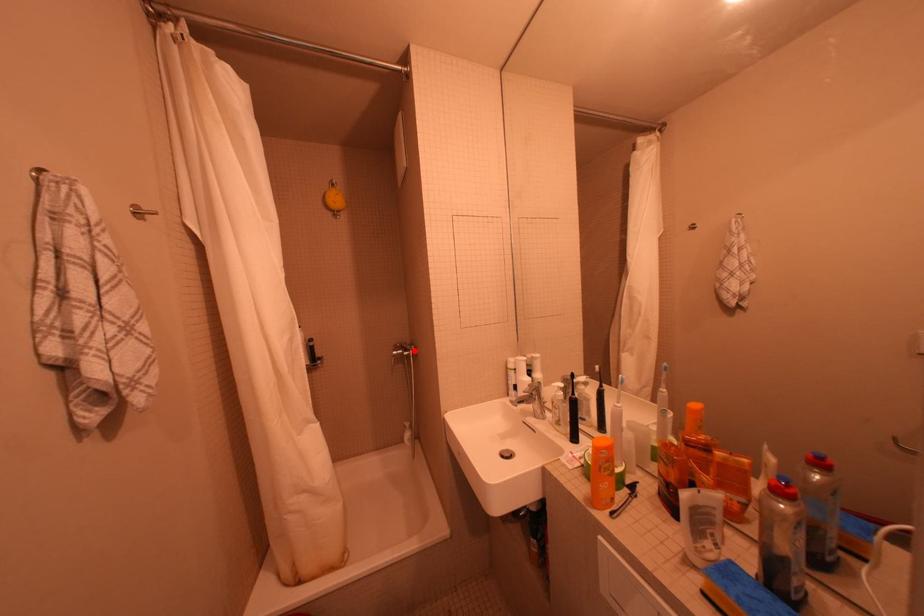
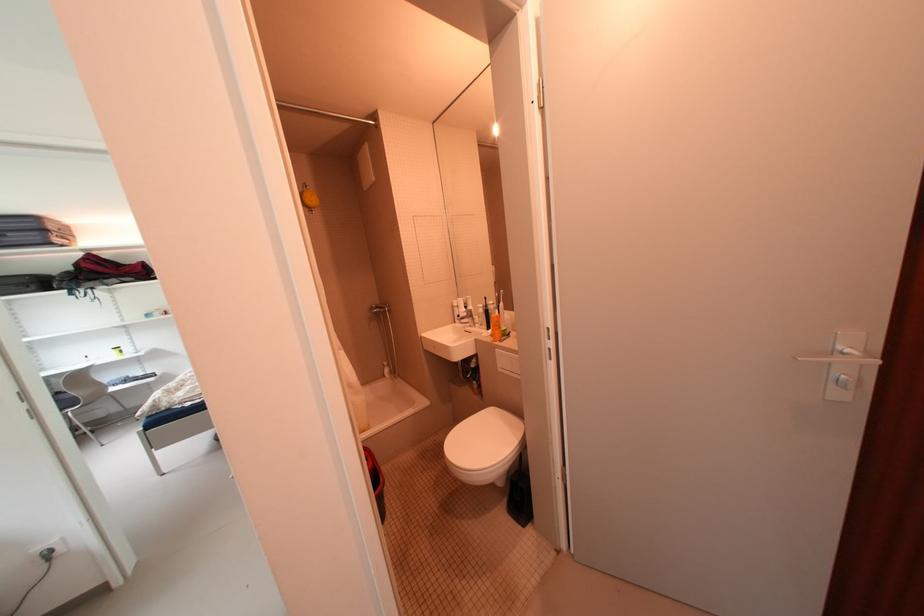
In the second image, find the point that corresponds to the highlighted location in the first image.

(390, 309)